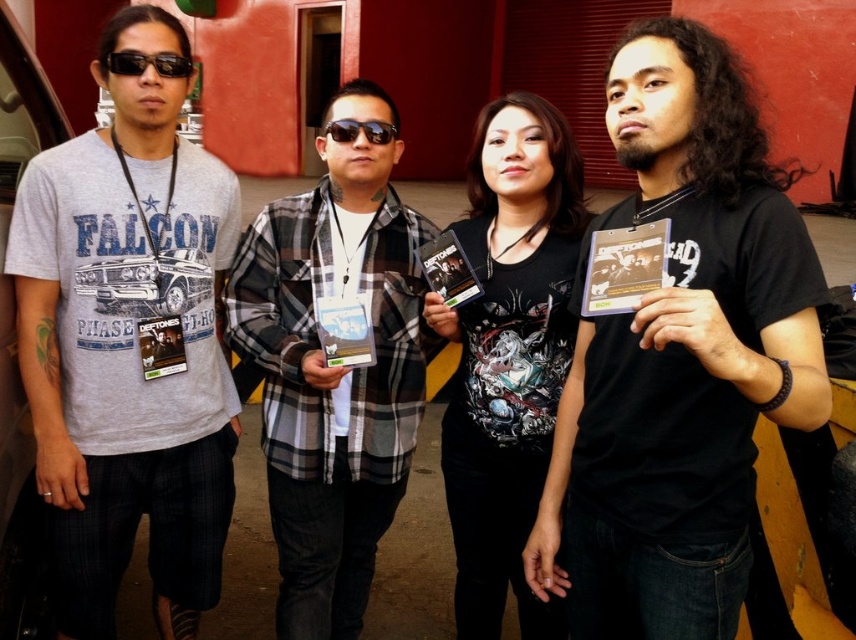
Question: Is plaid flannel shirt at center to the right of black plastic sunglasses at upper left from the viewer's perspective?

Choices:
 (A) no
 (B) yes

Answer: (B)

Question: Which of these objects is positioned farthest from the matte plastic cd at right?

Choices:
 (A) black matte t-shirt at center
 (B) matte plastic dvd case at center

Answer: (B)

Question: Which object appears farthest from the camera in this image?

Choices:
 (A) matte plastic cd at right
 (B) gray printed t-shirt at left

Answer: (B)

Question: Among these points, which one is nearest to the camera?

Choices:
 (A) [x=634, y=241]
 (B) [x=367, y=301]
 (C) [x=379, y=131]
 (D) [x=63, y=388]

Answer: (A)

Question: Does clear plastic cd at center have a greater width compared to matte black album at left?

Choices:
 (A) no
 (B) yes

Answer: (B)

Question: Is matte black album at left in front of black plastic sunglasses at upper left?

Choices:
 (A) no
 (B) yes

Answer: (A)